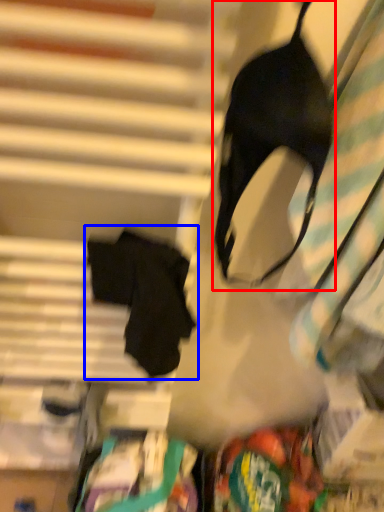
Question: Among these objects, which one is farthest to the camera, brassiere (highlighted by a red box) or robe (highlighted by a blue box)?

Choices:
 (A) brassiere
 (B) robe

Answer: (B)